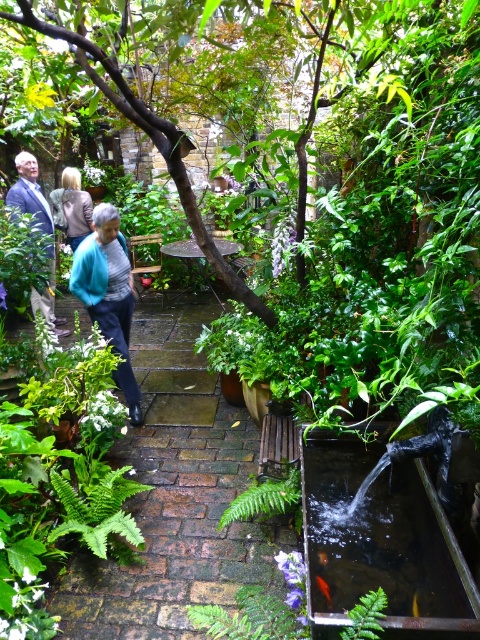
Is point (97, 524) in front of point (323, 589)?

No, (97, 524) is behind (323, 589).

Is green leafy fern at lower left smaller than gold shiny fish at lower center?

Actually, green leafy fern at lower left might be larger than gold shiny fish at lower center.

Does point (124, 564) come in front of point (327, 584)?

That is False.

I want to click on green leafy fern at lower left, so pos(100,515).

Who is higher up, light brown leather jacket at center or gold shiny fish at lower center?

Positioned higher is light brown leather jacket at center.

Is point (49, 195) behind point (320, 589)?

Yes, it is.

Between point (70, 225) and point (316, 577), which one is positioned in front?

Positioned in front is point (316, 577).

Locate an element on the screen. Image resolution: width=480 pixels, height=640 pixels. light brown leather jacket at center is located at coordinates (72, 208).

Who is taller, green leafy path at center or orange glossy fish at center?

With more height is green leafy path at center.

Does green leafy path at center have a lesser height compared to orange glossy fish at center?

In fact, green leafy path at center may be taller than orange glossy fish at center.

Is point (110, 564) closer to viewer compared to point (324, 560)?

No, (110, 564) is further to viewer.

The width and height of the screenshot is (480, 640). I want to click on green leafy path at center, so click(176, 496).